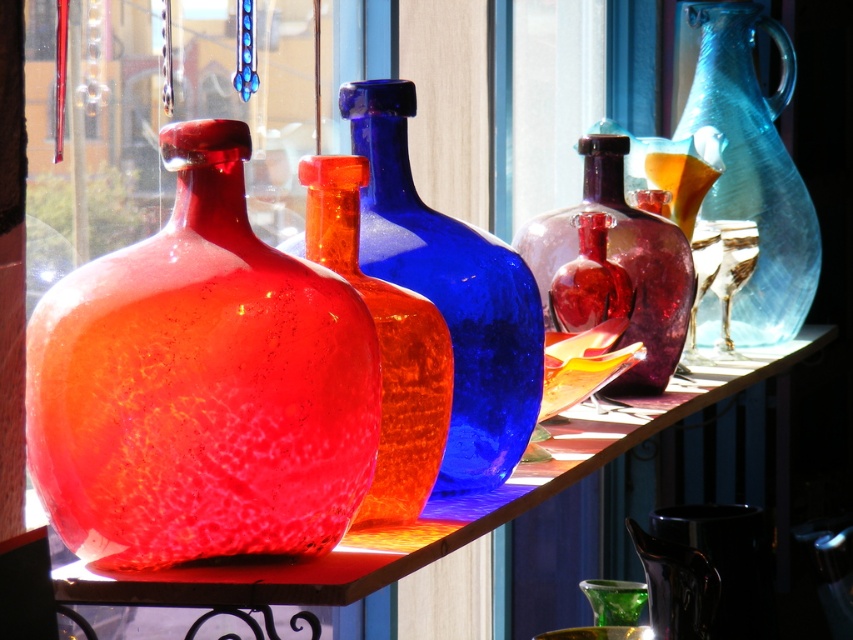
Is crackle glass vase at center above transparent blue glass pitcher at right?

Actually, crackle glass vase at center is below transparent blue glass pitcher at right.

At what (x,y) coordinates should I click in order to perform the action: click on crackle glass vase at center. Please return your answer as a coordinate pair (x, y). Looking at the image, I should click on (451, 502).

In order to click on crackle glass vase at center in this screenshot , I will do `click(451, 502)`.

Image resolution: width=853 pixels, height=640 pixels. What are the coordinates of `crackle glass vase at center` in the screenshot? It's located at (451, 502).

Does matte glass vase at left have a lesser width compared to crackle glass vase at center?

Yes, matte glass vase at left is thinner than crackle glass vase at center.

Describe the element at coordinates (200, 384) in the screenshot. I see `matte glass vase at left` at that location.

Where is `matte glass vase at left`? Image resolution: width=853 pixels, height=640 pixels. matte glass vase at left is located at coordinates (200, 384).

Who is higher up, crackle glass vase at center or matte glass vase at center?

matte glass vase at center is above.

Does crackle glass vase at center appear on the left side of matte glass vase at center?

No, crackle glass vase at center is not to the left of matte glass vase at center.

Is point (265, 564) positioned after point (595, 145)?

That is False.

Locate an element on the screen. crackle glass vase at center is located at coordinates (451, 502).